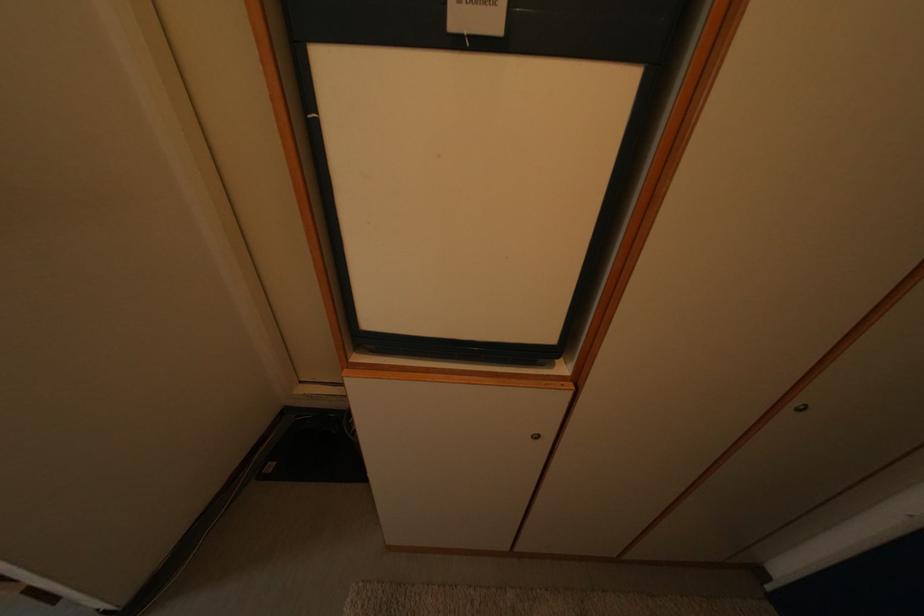
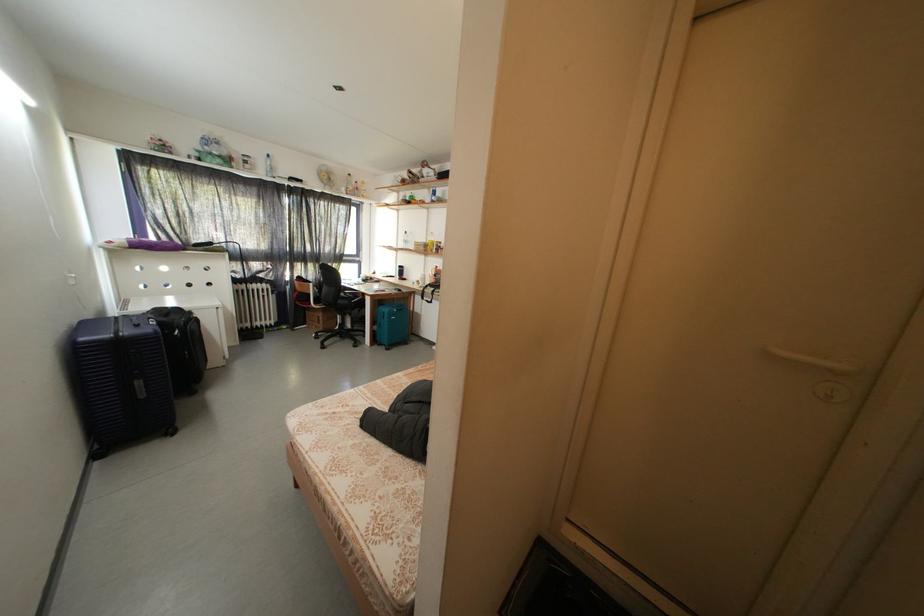
Question: The first image is from the beginning of the video and the second image is from the end. How did the camera likely rotate when shooting the video?

Choices:
 (A) Left
 (B) Right
 (C) Up
 (D) Down

Answer: (A)